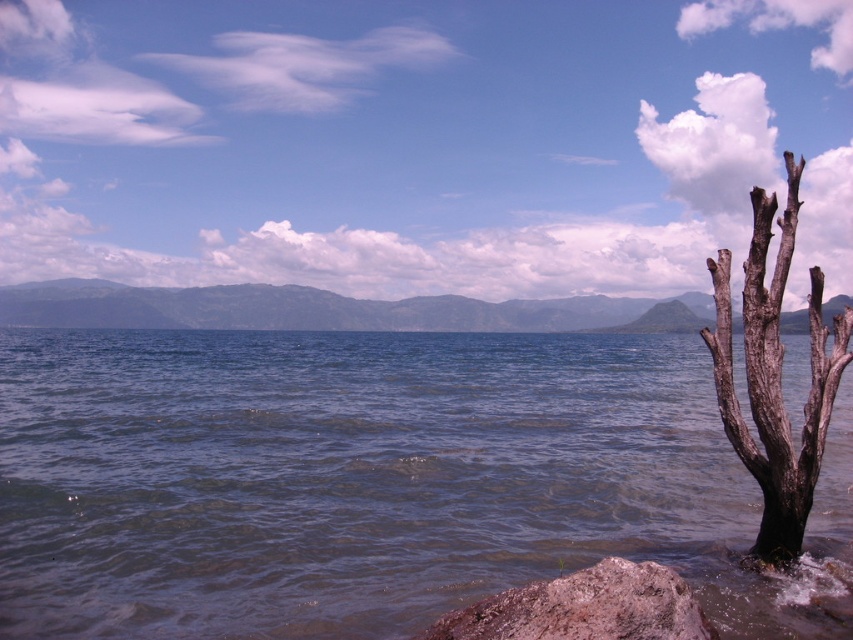
Question: Is clear water at lower left above dark brown bark tree at right?

Choices:
 (A) yes
 (B) no

Answer: (B)

Question: In this image, where is clear water at lower left located relative to rusty rock at lower right?

Choices:
 (A) above
 (B) below

Answer: (A)

Question: Among these objects, which one is farthest from the camera?

Choices:
 (A) clear water at lower left
 (B) dark brown bark tree at right

Answer: (B)

Question: Which object is the farthest from the dark brown bark tree at right?

Choices:
 (A) rusty rock at lower right
 (B) clear water at lower left

Answer: (B)

Question: Which object is closer to the camera taking this photo?

Choices:
 (A) rusty rock at lower right
 (B) clear water at lower left
 (C) dark brown bark tree at right

Answer: (A)

Question: Observing the image, what is the correct spatial positioning of clear water at lower left in reference to rusty rock at lower right?

Choices:
 (A) left
 (B) right

Answer: (A)